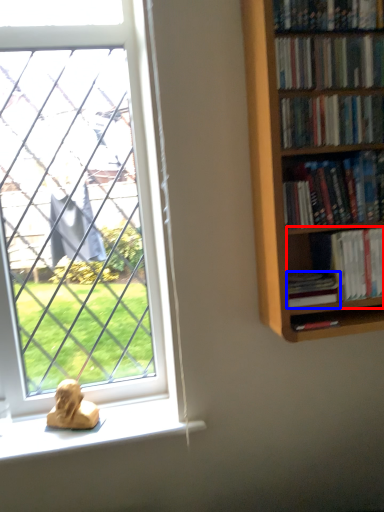
Question: Which of the following is the closest to the observer, book (highlighted by a red box) or book (highlighted by a blue box)?

Choices:
 (A) book
 (B) book

Answer: (B)